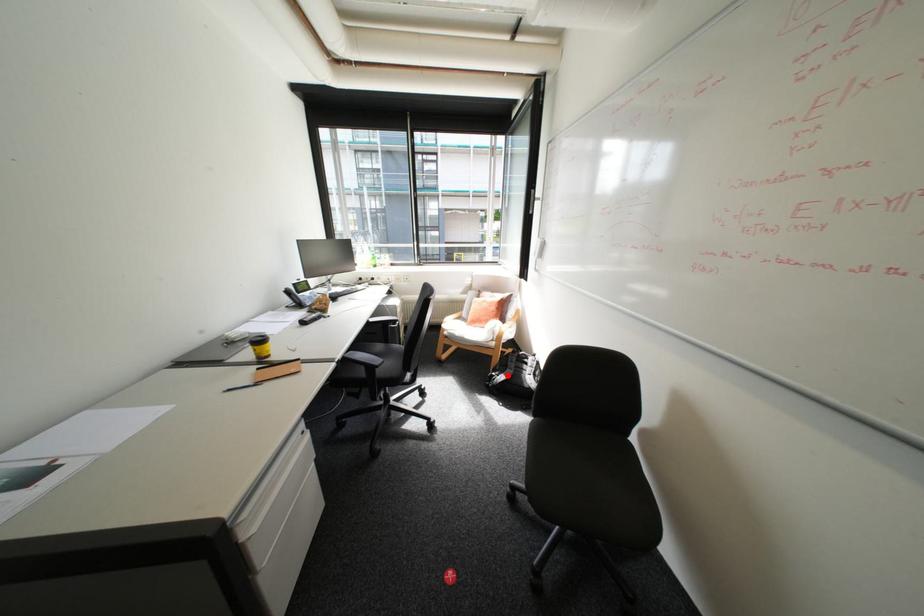
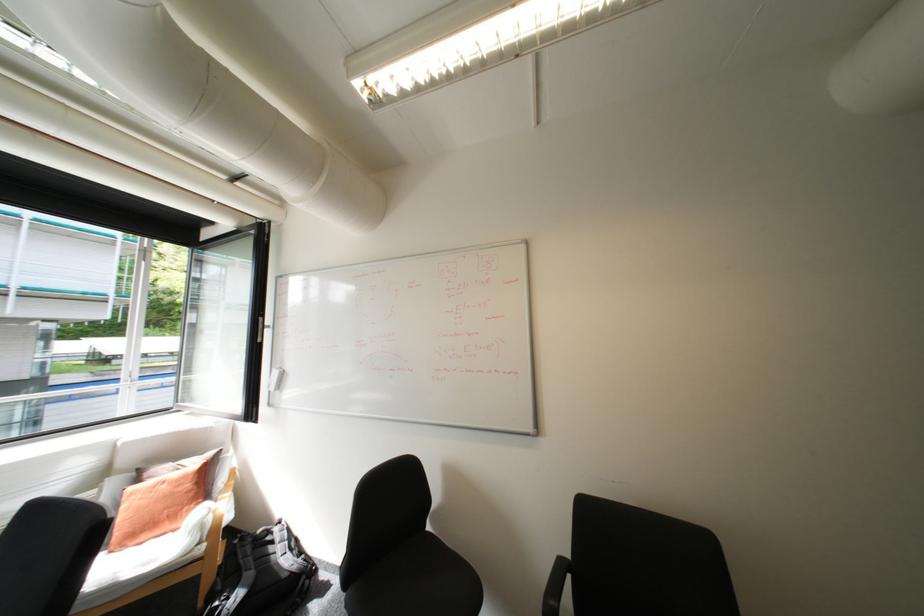
The point at the highlighted location is marked in the first image. Where is the corresponding point in the second image?

(238, 599)